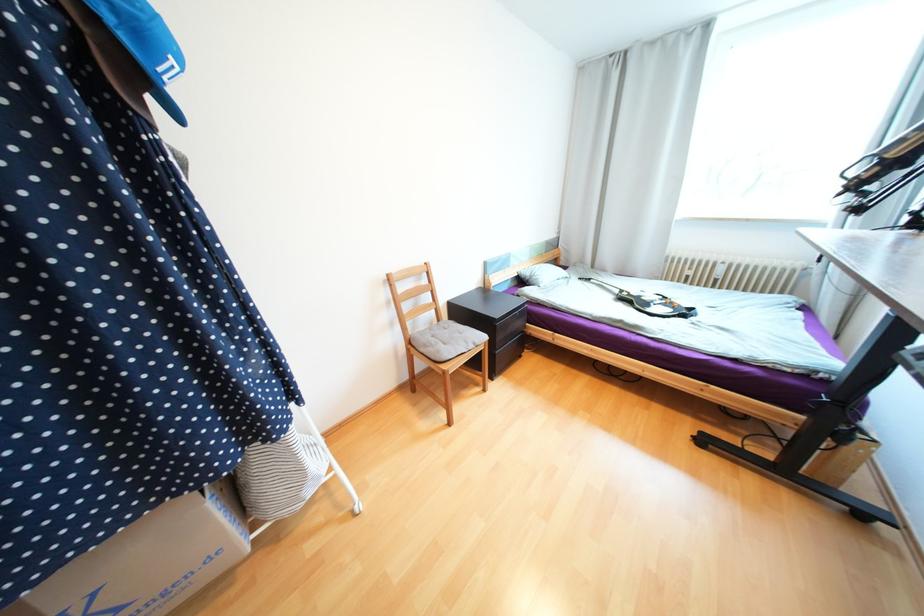
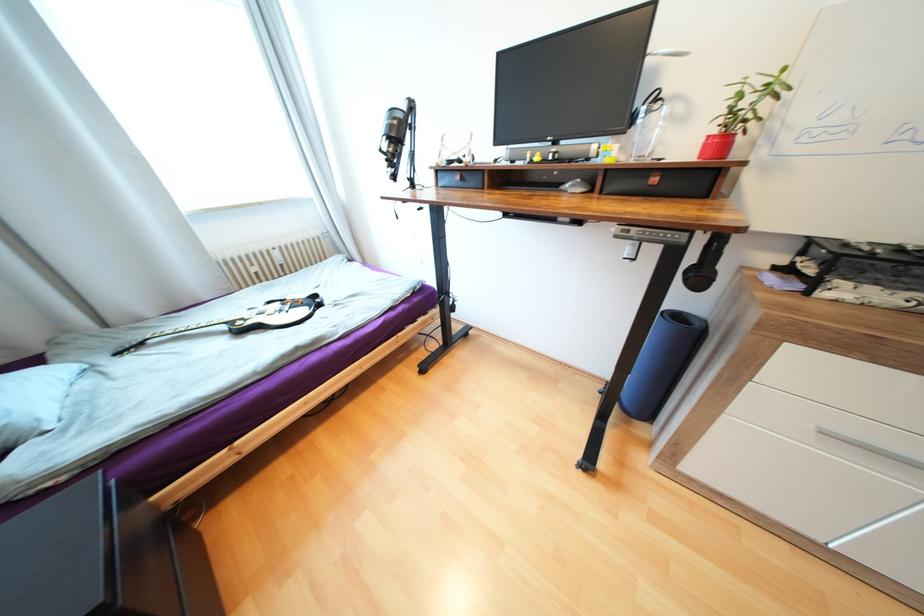
First-person continuous shooting, in which direction is the camera rotating?

The rotation direction of the camera is right-down.